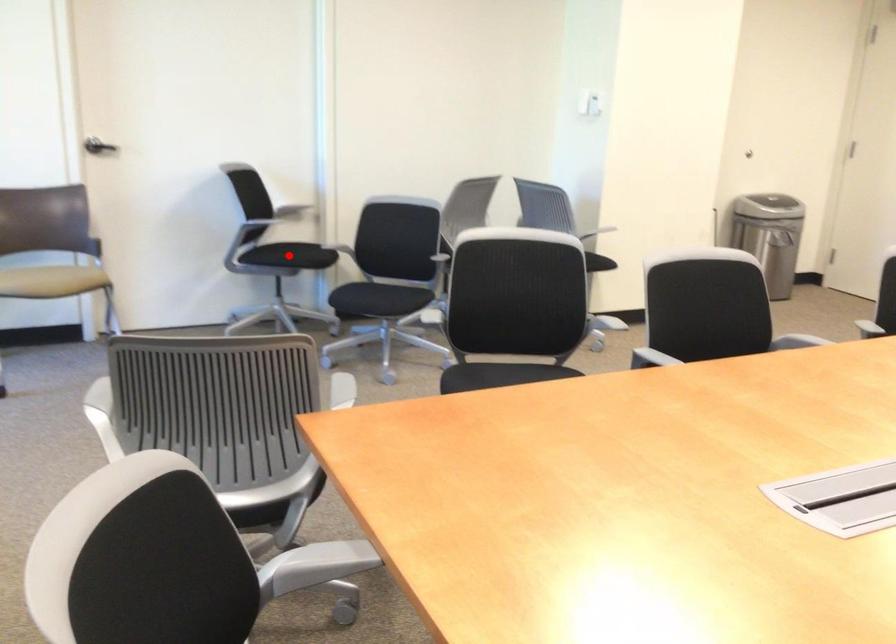
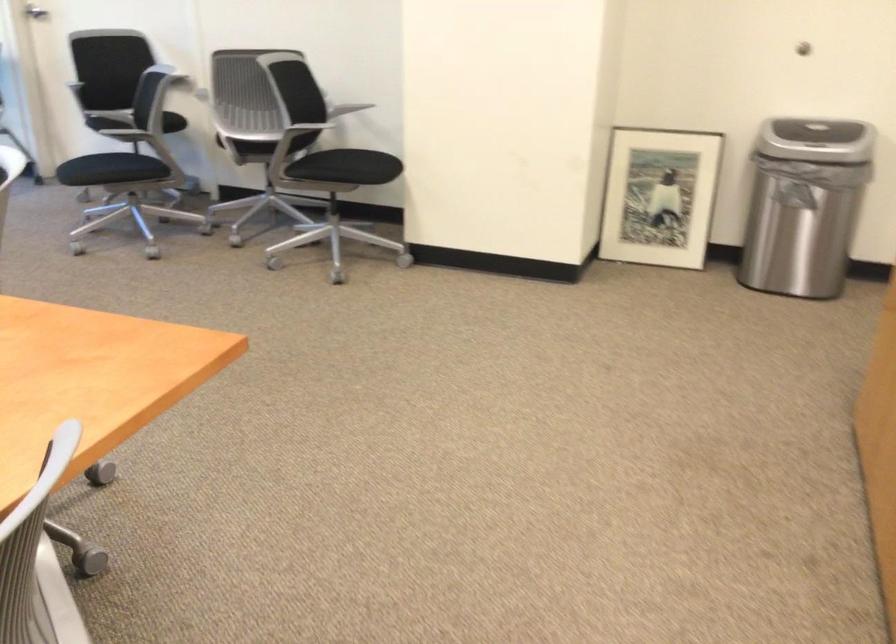
Question: I am providing you with two images of the same scene from different viewpoints. A red point is marked on the first image. Can you still see the location of the red point in image 2?

Choices:
 (A) Yes
 (B) No

Answer: (B)